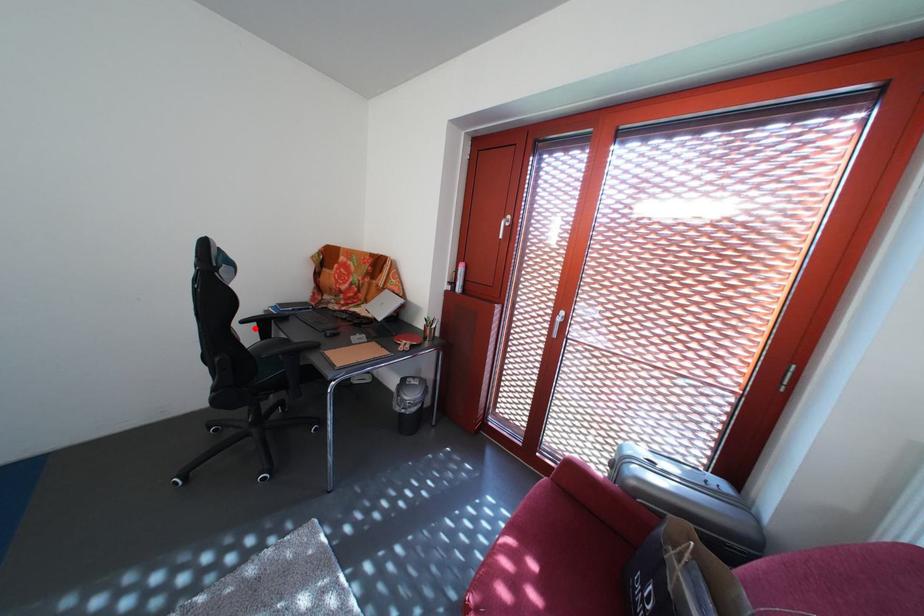
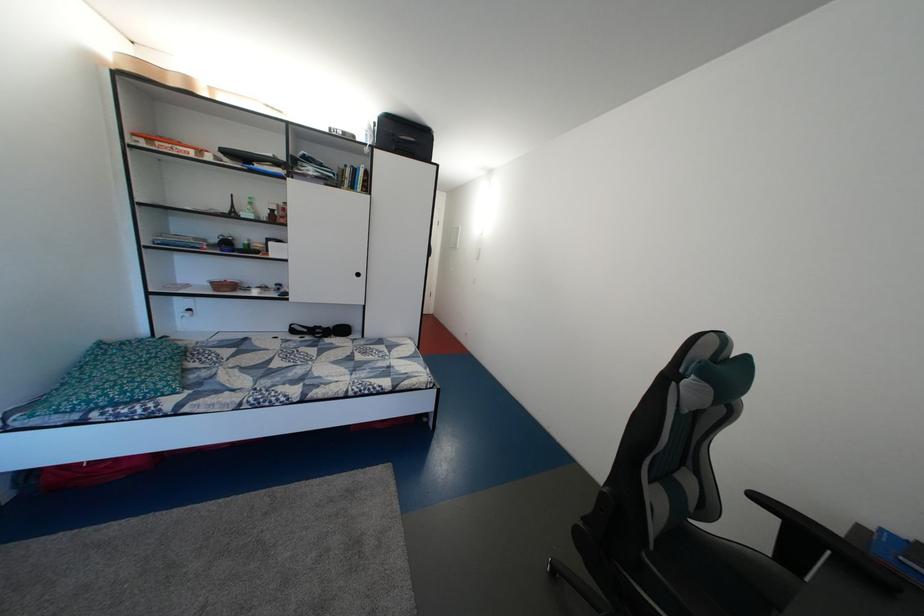
Find the pixel in the second image that matches the highlighted location in the first image.

(768, 504)